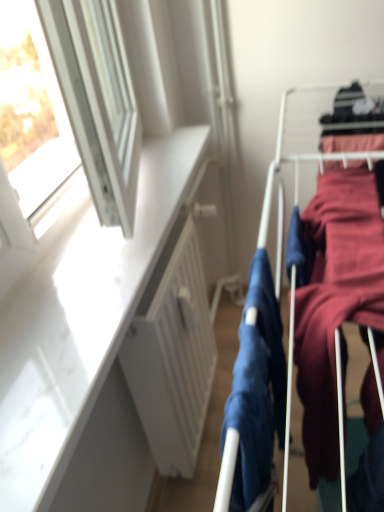
Question: Is white matte radiator at center looking in the opposite direction of matte blue fabric at center, arranged as the 2th clothing when viewed from the right?

Choices:
 (A) no
 (B) yes

Answer: (A)

Question: From the image's perspective, is white matte radiator at center under matte blue fabric at center, which is counted as the 1th clothing, starting from the left?

Choices:
 (A) no
 (B) yes

Answer: (B)

Question: Considering the relative positions of white matte radiator at center and matte blue fabric at center, arranged as the 2th clothing when viewed from the right, in the image provided, is white matte radiator at center in front of matte blue fabric at center, arranged as the 2th clothing when viewed from the right,?

Choices:
 (A) no
 (B) yes

Answer: (A)

Question: Is white matte radiator at center shorter than matte blue fabric at center, arranged as the 2th clothing when viewed from the right?

Choices:
 (A) no
 (B) yes

Answer: (A)

Question: Is white matte radiator at center taller than matte blue fabric at center, which is counted as the 1th clothing, starting from the left?

Choices:
 (A) yes
 (B) no

Answer: (A)

Question: Considering the positions of velvet-like maroon dress at right, the second clothing from the left, and white matte radiator at center in the image, is velvet-like maroon dress at right, the second clothing from the left, bigger or smaller than white matte radiator at center?

Choices:
 (A) small
 (B) big

Answer: (B)

Question: From the image's perspective, is velvet-like maroon dress at right, the 1th clothing positioned from the right, above or below white matte radiator at center?

Choices:
 (A) above
 (B) below

Answer: (A)

Question: Is velvet-like maroon dress at right, the 1th clothing positioned from the right, taller or shorter than white matte radiator at center?

Choices:
 (A) short
 (B) tall

Answer: (A)

Question: Considering the relative positions of velvet-like maroon dress at right, the 1th clothing positioned from the right, and white matte radiator at center in the image provided, is velvet-like maroon dress at right, the 1th clothing positioned from the right, to the left or to the right of white matte radiator at center?

Choices:
 (A) left
 (B) right

Answer: (B)

Question: From a real-world perspective, is white matte radiator at center physically located above or below matte blue fabric at center, which is counted as the 1th clothing, starting from the left?

Choices:
 (A) above
 (B) below

Answer: (B)

Question: In the image, is white matte radiator at center on the left side or the right side of matte blue fabric at center, which is counted as the 1th clothing, starting from the left?

Choices:
 (A) right
 (B) left

Answer: (B)

Question: Is point (127, 342) positioned closer to the camera than point (246, 303)?

Choices:
 (A) closer
 (B) farther

Answer: (B)

Question: Is white matte radiator at center situated inside matte blue fabric at center, arranged as the 2th clothing when viewed from the right, or outside?

Choices:
 (A) inside
 (B) outside

Answer: (B)

Question: Looking at their shapes, would you say matte blue fabric at center, which is counted as the 1th clothing, starting from the left, is wider or thinner than white matte radiator at center?

Choices:
 (A) wide
 (B) thin

Answer: (B)

Question: Based on their positions, is matte blue fabric at center, arranged as the 2th clothing when viewed from the right, located to the left or right of white matte radiator at center?

Choices:
 (A) right
 (B) left

Answer: (A)